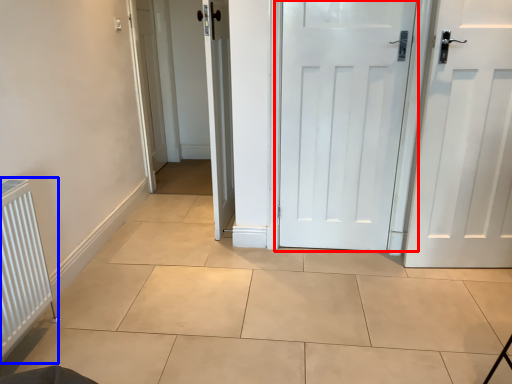
Question: Among these objects, which one is farthest to the camera, door (highlighted by a red box) or radiator (highlighted by a blue box)?

Choices:
 (A) door
 (B) radiator

Answer: (A)